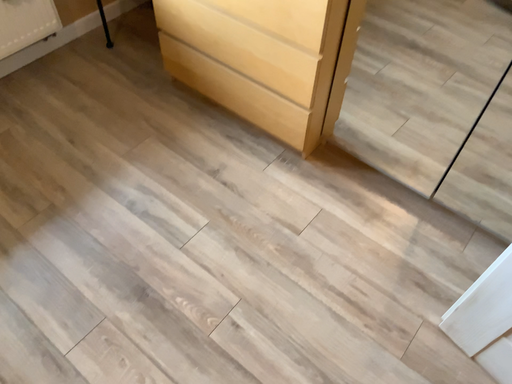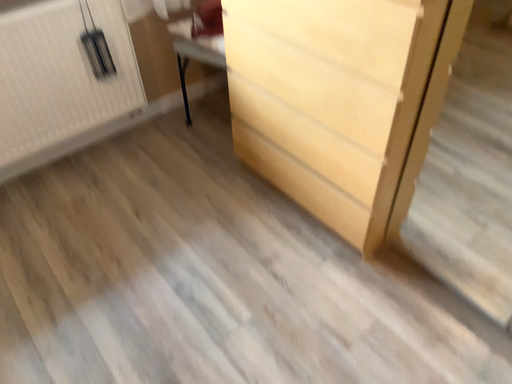
Question: How did the camera likely rotate when shooting the video?

Choices:
 (A) rotated right
 (B) rotated left

Answer: (B)